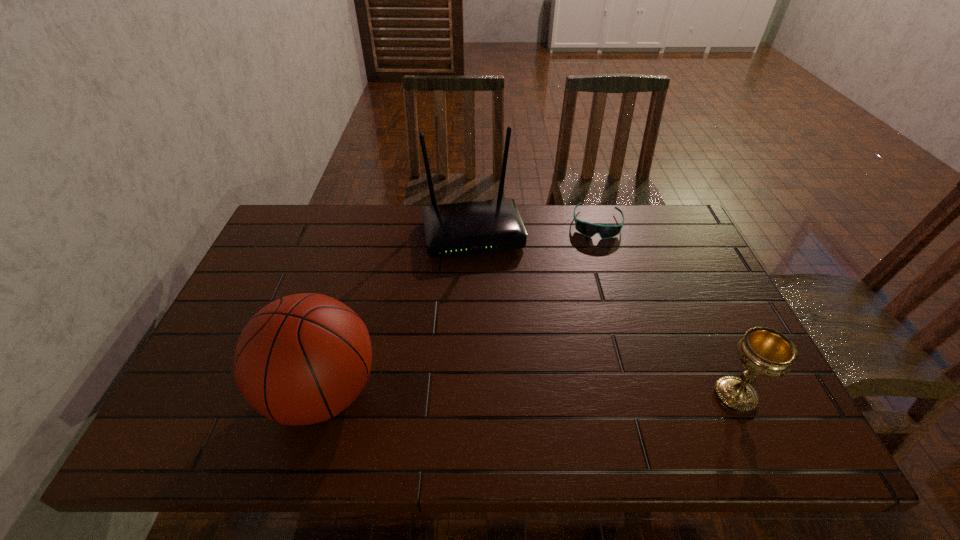
Identify the location of free space located 0.130m on the front-facing side of the router. This screenshot has height=540, width=960. (490, 293).

In order to click on free space located on the front-facing side of the sunglasses in this screenshot , I will do pos(596,254).

The width and height of the screenshot is (960, 540). I want to click on free space located 0.390m on the front-facing side of the sunglasses, so click(592, 336).

At what (x,y) coordinates should I click in order to perform the action: click on free space located on the front-facing side of the sunglasses. Please return your answer as a coordinate pair (x, y). The width and height of the screenshot is (960, 540). Looking at the image, I should click on (596, 251).

At what (x,y) coordinates should I click in order to perform the action: click on router present at the far edge. Please return your answer as a coordinate pair (x, y). Looking at the image, I should click on (463, 228).

You are a GUI agent. You are given a task and a screenshot of the screen. Output one action in this format:
    pyautogui.click(x=<x>, y=<y>)
    Task: Click on the sunglasses that is at the far edge
    
    Given the screenshot: What is the action you would take?
    pyautogui.click(x=588, y=229)

Where is `basketball that is at the near edge`? The image size is (960, 540). basketball that is at the near edge is located at coordinates (302, 359).

Image resolution: width=960 pixels, height=540 pixels. I want to click on chalice positioned at the near edge, so click(763, 351).

Image resolution: width=960 pixels, height=540 pixels. I want to click on object at the right edge, so click(x=763, y=351).

Locate an element on the screen. This screenshot has width=960, height=540. object that is at the near right corner is located at coordinates (763, 351).